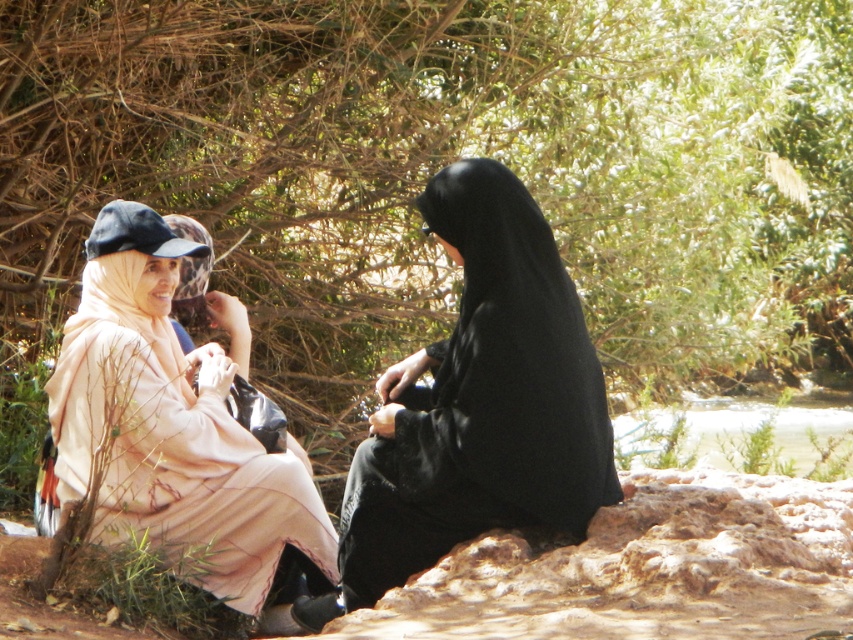
You are standing at the origin point in the image. There are two points marked as point 1 at coordinates (166, 250) and point 2 at coordinates (724, 422). If you want to walk to point 2, will you pass through point 1 first?

Point 1 at coordinates (166, 250) is in front of point 2 at coordinates (724, 422). Therefore, walking towards point 2 from the origin, you would pass through point 1 first before reaching point 2.

You are a photographer trying to capture a portrait of both individuals in the scene. Since you want to ensure both subjects are framed properly, which direction should you move your camera to focus on the black matte dress at center without losing the pale pink fabric at left in the frame?

Since the black matte dress at center is to the right of the pale pink fabric at left, you should move your camera slightly to the right to focus on the black matte dress at center while keeping the pale pink fabric at left within the frame.

You are a photographer standing in front of the two individuals. You want to take a photo that focuses on the black matte dress at center without the pale pink fabric at left being in the foreground. Can you adjust your position to achieve this?

The black matte dress at center is closer to the viewer than the pale pink fabric at left, so by moving your position to align the camera so that the black matte dress at center is in front of the pale pink fabric at left, you can focus on the black matte dress at center without the pale pink fabric at left being in the foreground.